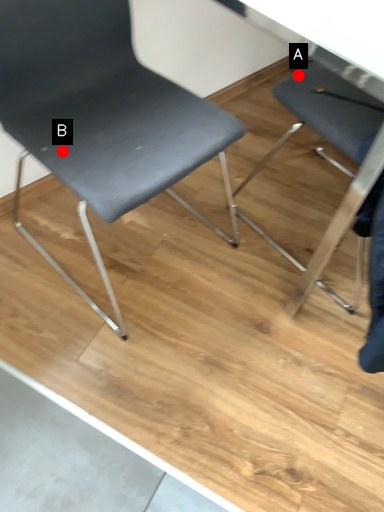
Question: Two points are circled on the image, labeled by A and B beside each circle. Which point is farther from the camera taking this photo?

Choices:
 (A) A is further
 (B) B is further

Answer: (A)